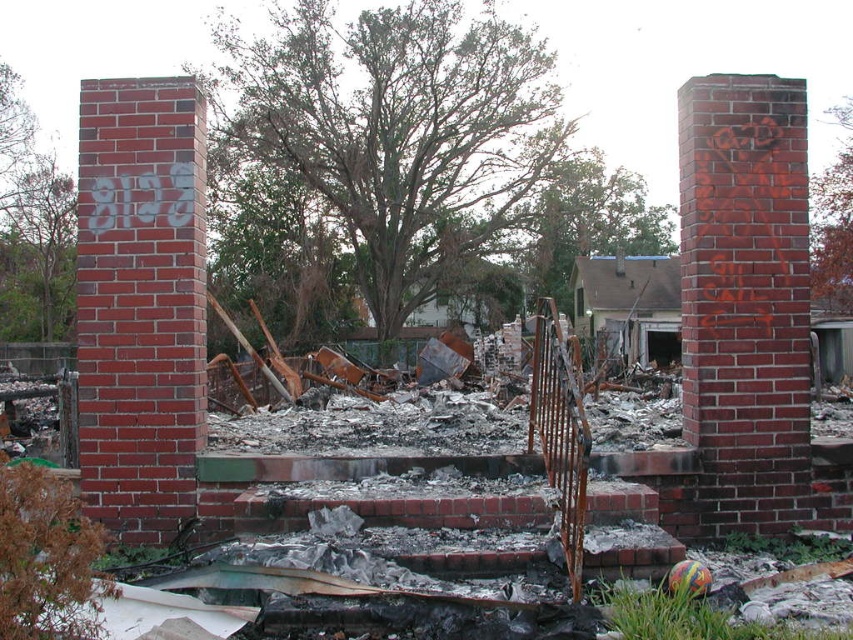
Question: Among these objects, which one is nearest to the camera?

Choices:
 (A) red brick chimney at center
 (B) red brick chimney at left

Answer: (B)

Question: Does red brick chimney at center come behind red brick chimney at left?

Choices:
 (A) yes
 (B) no

Answer: (A)

Question: Does red brick chimney at center have a greater width compared to red brick chimney at left?

Choices:
 (A) yes
 (B) no

Answer: (B)

Question: Can you confirm if red brick chimney at center is positioned above red brick chimney at left?

Choices:
 (A) yes
 (B) no

Answer: (B)